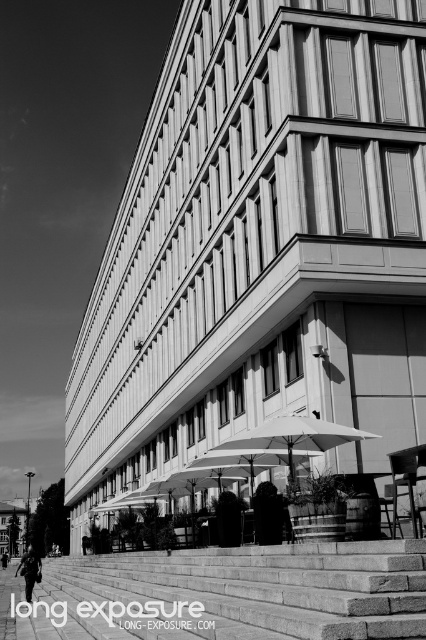
You are standing at the bottom of the granite steps at lower center and want to walk up to the patio. Will the white fabric umbrella at center provide shade over the steps as you climb?

The granite steps at lower center is positioned under white fabric umbrella at center, so yes, the white fabric umbrella at center will provide shade over the steps as you climb.

You are standing at the bottom of the granite steps at lower center and want to walk to the white fabric umbrella at center. Which direction should you move relative to the steps to reach the umbrella?

The granite steps at lower center are positioned on the left side of the white fabric umbrella at center, so to reach the umbrella, you should move to the right from the steps.

You are standing at the base of the granite steps at lower center and want to walk towards the white fabric umbrella at center. Which direction should you move to get closer to the umbrella?

Since the granite steps at lower center is closer to the viewer than the white fabric umbrella at center, you should move forward towards the building to get closer to the white fabric umbrella at center.